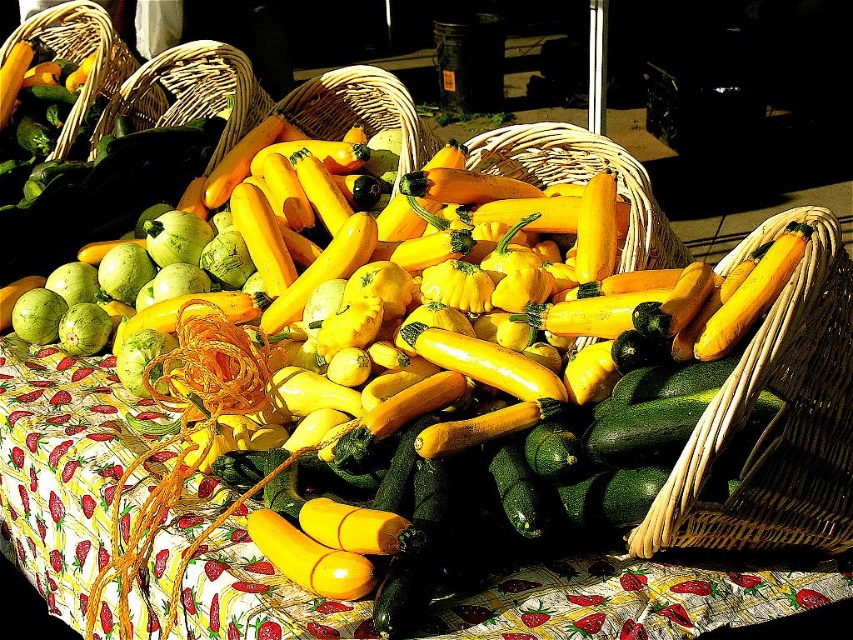
Is woven straw basket at center thinner than woven straw basket at upper left?

Yes, woven straw basket at center is thinner than woven straw basket at upper left.

Does woven straw basket at center have a smaller size compared to woven straw basket at upper left?

Yes.

Who is more distant from viewer, (506, 156) or (198, 60)?

The point (198, 60) is behind.

Locate an element on the screen. The height and width of the screenshot is (640, 853). woven straw basket at center is located at coordinates (583, 180).

Between strawberry-patterned fabric at center and woven wicker basket at right, which one appears on the right side from the viewer's perspective?

Positioned to the right is woven wicker basket at right.

Measure the distance from strawberry-patterned fabric at center to woven wicker basket at right.

The distance of strawberry-patterned fabric at center from woven wicker basket at right is 23.42 inches.

Locate an element on the screen. strawberry-patterned fabric at center is located at coordinates (62, 465).

Where is `strawberry-patterned fabric at center`? The height and width of the screenshot is (640, 853). strawberry-patterned fabric at center is located at coordinates (62, 465).

Can you confirm if woven wicker basket at right is positioned below woven straw basket at upper left?

Correct, woven wicker basket at right is located below woven straw basket at upper left.

Does woven wicker basket at right have a lesser width compared to woven straw basket at upper left?

Yes, woven wicker basket at right is thinner than woven straw basket at upper left.

This screenshot has height=640, width=853. Find the location of `woven wicker basket at right`. woven wicker basket at right is located at coordinates (775, 417).